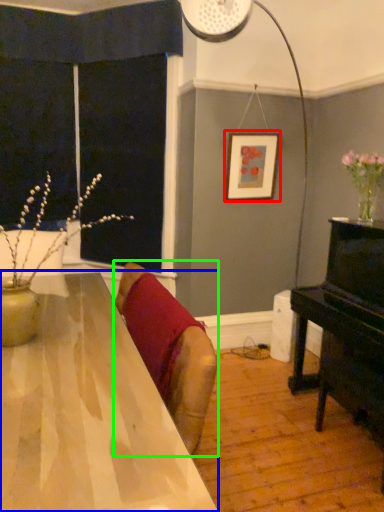
Question: Which object is positioned closest to picture frame (highlighted by a red box)? Select from table (highlighted by a blue box) and swivel chair (highlighted by a green box).

Choices:
 (A) table
 (B) swivel chair

Answer: (B)